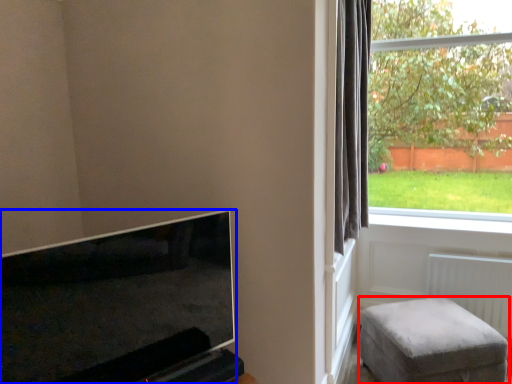
Question: Among these objects, which one is nearest to the camera, furniture (highlighted by a red box) or television (highlighted by a blue box)?

Choices:
 (A) furniture
 (B) television

Answer: (B)